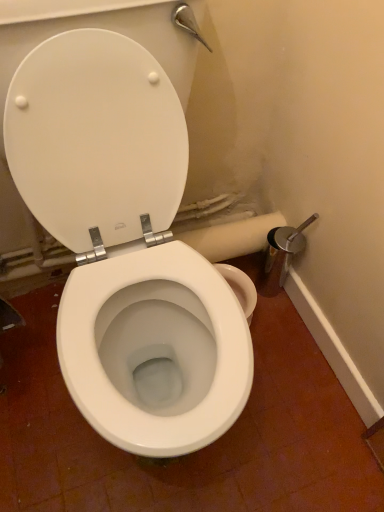
Question: Is white matte toilet paper at center situated inside white glossy toilet at center or outside?

Choices:
 (A) inside
 (B) outside

Answer: (A)

Question: Is point (215, 225) positioned closer to the camera than point (208, 345)?

Choices:
 (A) farther
 (B) closer

Answer: (A)

Question: Which is farther from the white plastic toilet seat at center?

Choices:
 (A) white matte toilet paper at center
 (B) white glossy toilet at center

Answer: (A)

Question: Based on their relative distances, which object is farther from the white matte toilet paper at center?

Choices:
 (A) white plastic toilet seat at center
 (B) white glossy toilet at center

Answer: (A)